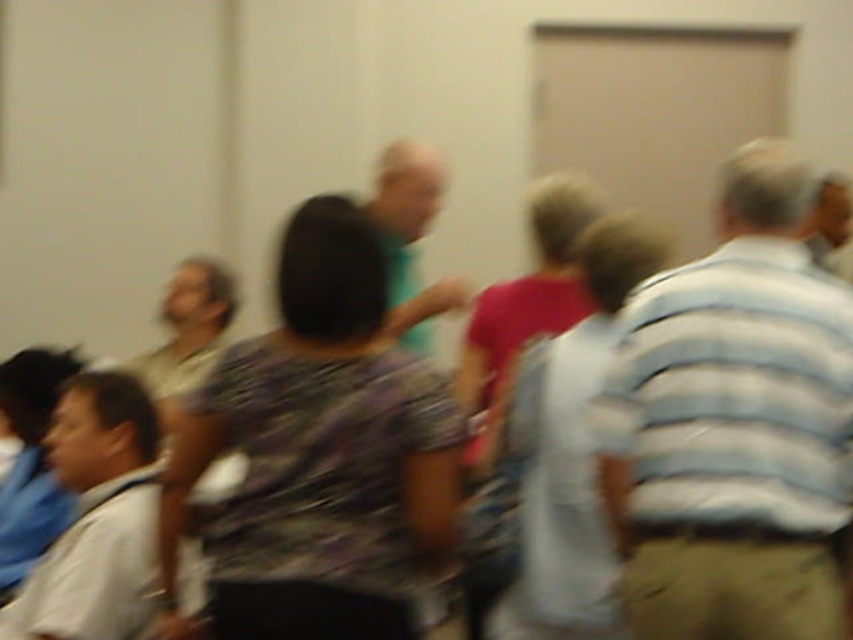
You are a security guard reviewing a blurry surveillance image. You notice two items of clothing in the scene. The khaki pants at right and the black matte shirt at center. Based on their positions in the image, which clothing item is closer to the floor?

The khaki pants at right is below the black matte shirt at center, so the khaki pants at right is closer to the floor.

You are standing at point (753, 376) and want to reach the door in the background. The space between you and the door is 1.74 meters. If you are 1.6 meters tall, will you be able to walk through the space without bending down?

The space between you and the door is 1.74 meters, which is wider than your height of 1.6 meters. Therefore, you can walk through without bending down.

You are organizing a photo shoot and need to arrange two shirts for a size comparison. Given the image, which of the two shirts, the light gray shirt at lower left or the black matte shirt at center, would you choose as the taller one for the display?

The black matte shirt at center is taller than the light gray shirt at lower left, so you should choose the black matte shirt at center as the taller one for the display.